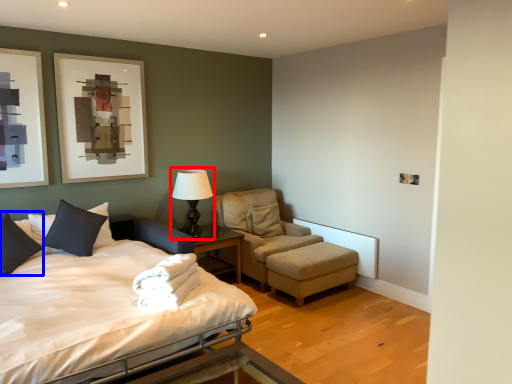
Question: Which object appears closest to the camera in this image, table lamp (highlighted by a red box) or pillow (highlighted by a blue box)?

Choices:
 (A) table lamp
 (B) pillow

Answer: (B)